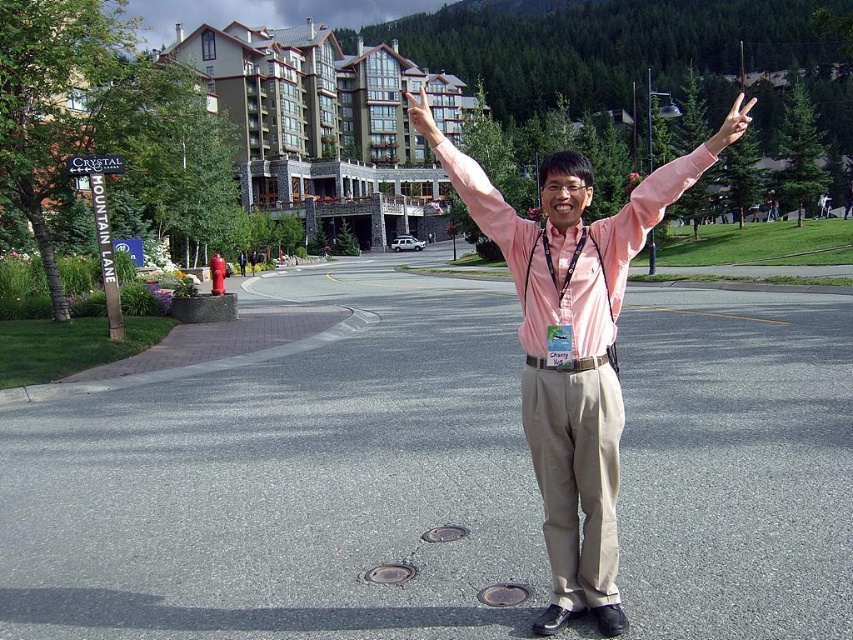
You are taking a photo of the scene and want to focus on both the point at point (479, 225) and the point at point (418, 116). Which point should you adjust your focus to first to ensure both are in clear view?

You should focus on point (418, 116) first because it is closer to the camera than point (479, 225). By focusing on the closer point, the further point will also be in focus due to the depth of field.